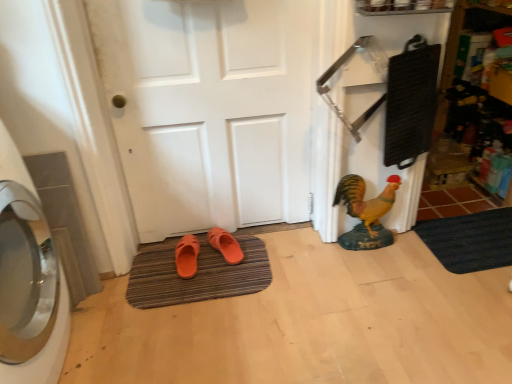
Locate an element on the screen. vacant area on top of brown striped bath mat at center, placed as the second bath mat when sorted from right to left (from a real-world perspective) is located at coordinates 198,266.